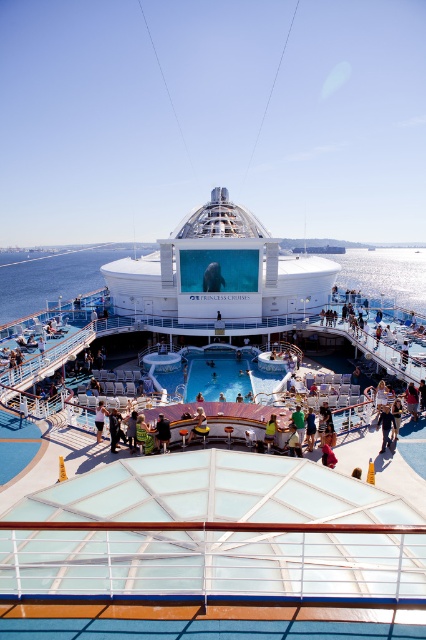
You are a passenger on the cruise ship deck. You see the dark blue jeans at center and the yellow fabric at center. Which object is closer to you?

The dark blue jeans at center is closer to you because the yellow fabric at center is behind it.

You are a passenger on the cruise ship and want to know which object is taller between the blue glossy pool at center and the yellow fabric at center. Can you determine this?

The blue glossy pool at center is taller than the yellow fabric at center according to the description.